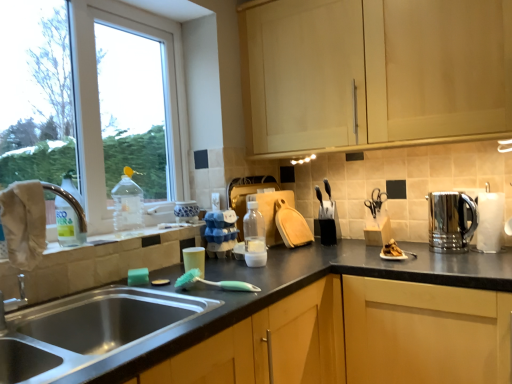
This screenshot has height=384, width=512. What do you see at coordinates (125, 238) in the screenshot?
I see `yellow matte window sill at lower left` at bounding box center [125, 238].

Locate an element on the screen. matte wood cabinet at upper center is located at coordinates (374, 71).

What is the approximate width of matte wood cabinet at upper center?

matte wood cabinet at upper center is 33.91 centimeters wide.

In order to face stainless steel sink at lower left, should I rotate leftwards or rightwards?

To align with it, rotate left about 10.989°.

Image resolution: width=512 pixels, height=384 pixels. What are the coordinates of `transparent plastic bottle at window, marked as the second bottle in a left-to-right arrangement` in the screenshot? It's located at (127, 206).

Consider the image. Does beige fabric at sink left turn towards polished stainless steel kettle at right, which is the first appliance in right-to-left order?

No.

From the image's perspective, which appliance is the 2nd one below the beige fabric at sink left? Please provide its 2D coordinates.

[(450, 221)]

Is polished stainless steel kettle at right, which is the first appliance in right-to-left order, surrounded by beige fabric at sink left?

No, polished stainless steel kettle at right, which is the first appliance in right-to-left order, is not a part of beige fabric at sink left.

Can you tell me how much beige fabric at sink left and polished stainless steel kettle at right, positioned as the third appliance in left-to-right order, differ in facing direction?

beige fabric at sink left and polished stainless steel kettle at right, positioned as the third appliance in left-to-right order, are facing 87.3 degrees away from each other.

From the image's perspective, between matte wood cabinet at upper center and translucent plastic bottle at left, placed as the 3th bottle when sorted from right to left, who is located below?

translucent plastic bottle at left, placed as the 3th bottle when sorted from right to left.

Considering the sizes of objects matte wood cabinet at upper center and translucent plastic bottle at left, placed as the 3th bottle when sorted from right to left, in the image provided, who is wider, matte wood cabinet at upper center or translucent plastic bottle at left, placed as the 3th bottle when sorted from right to left,?

With larger width is matte wood cabinet at upper center.

Is translucent plastic bottle at left, arranged as the first bottle when viewed from the front, at the back of matte wood cabinet at upper center?

No, matte wood cabinet at upper center is not facing the opposite direction of translucent plastic bottle at left, arranged as the first bottle when viewed from the front.

Which object is closer to the camera, translucent plastic cup at sink or polished stainless steel kettle at right, which is the first appliance in right-to-left order?

translucent plastic cup at sink is more forward.

Between translucent plastic cup at sink and polished stainless steel kettle at right, which is the first appliance in right-to-left order, which one has smaller width?

With smaller width is translucent plastic cup at sink.

The image size is (512, 384). I want to click on tableware that appears below the polished stainless steel kettle at right, which is the first appliance in right-to-left order (from the image's perspective), so click(x=194, y=259).

From their relative heights in the image, would you say translucent plastic cup at sink is taller or shorter than polished stainless steel kettle at right, positioned as the third appliance in left-to-right order?

Clearly, translucent plastic cup at sink is shorter compared to polished stainless steel kettle at right, positioned as the third appliance in left-to-right order.

In the scene shown: Considering the sizes of objects translucent plastic cup at sink and stainless steel sink at lower left in the image provided, who is thinner, translucent plastic cup at sink or stainless steel sink at lower left?

With smaller width is translucent plastic cup at sink.

Which object is more forward, translucent plastic cup at sink or stainless steel sink at lower left?

stainless steel sink at lower left is closer to the camera.

You are a GUI agent. You are given a task and a screenshot of the screen. Output one action in this format:
    pyautogui.click(x=<x>, y=<y>)
    Task: Click on the sink in front of the translucent plastic cup at sink
    
    Given the screenshot: What is the action you would take?
    pyautogui.click(x=88, y=330)

Is translucent plastic cup at sink taller than stainless steel sink at lower left?

Incorrect, the height of translucent plastic cup at sink is not larger of that of stainless steel sink at lower left.

Does yellow matte window sill at lower left have a greater height compared to translucent plastic cup at sink?

No, yellow matte window sill at lower left is not taller than translucent plastic cup at sink.

From the image's perspective, does yellow matte window sill at lower left appear lower than translucent plastic cup at sink?

No.

How different are the orientations of yellow matte window sill at lower left and translucent plastic cup at sink in degrees?

0.473 degrees.

Which is behind, point (441, 203) or point (278, 119)?

Point (278, 119)

Would you consider polished stainless steel kettle at right, which is the first appliance in right-to-left order, to be distant from matte wood cabinet at upper center?

They are positioned close to each other.

Between polished stainless steel kettle at right, which is the first appliance in right-to-left order, and matte wood cabinet at upper center, which one has smaller size?

With smaller size is polished stainless steel kettle at right, which is the first appliance in right-to-left order.

I want to click on appliance that appears on the right of matte wood cabinet at upper center, so tap(450, 221).

Is transparent plastic bottle at window, positioned as the second bottle in back-to-front order, closer to the viewer compared to blue and white ceramic jar at upper center, the 1th appliance viewed from the left?

Yes.

Could you tell me if transparent plastic bottle at window, positioned as the second bottle in back-to-front order, is facing blue and white ceramic jar at upper center, the 1th appliance viewed from the left?

No.

Which is behind, point (125, 224) or point (176, 219)?

The point (176, 219) is more distant.

Between transparent plastic bottle at window, positioned as the second bottle in back-to-front order, and blue and white ceramic jar at upper center, the 1th appliance viewed from the left, which one has less height?

With less height is blue and white ceramic jar at upper center, the 1th appliance viewed from the left.

The image size is (512, 384). Identify the location of faucet in front of the polished stainless steel kettle at right, which is the first appliance in right-to-left order. (70, 204).

Image resolution: width=512 pixels, height=384 pixels. Find the location of `the 2nd bottle positioned below the matte wood cabinet at upper center (from the image's perspective)`. the 2nd bottle positioned below the matte wood cabinet at upper center (from the image's perspective) is located at coordinates (69, 215).

Looking at this image, when comparing their distances from translucent plastic bottle at center, placed as the 3th bottle when sorted from front to back, does stainless steel sink at lower left or white paper towel at right seem further?

white paper towel at right is further to translucent plastic bottle at center, placed as the 3th bottle when sorted from front to back.

From the image, which object appears to be farther from white paper towel at right, matte wood cabinet at upper center or blue and white ceramic jar at upper center, arranged as the 3th appliance when viewed from the right?

blue and white ceramic jar at upper center, arranged as the 3th appliance when viewed from the right, lies further to white paper towel at right than the other object.

Considering their positions, is beige fabric at sink left positioned closer to black plastic knife block at upper right, which is the 2th appliance from left to right, than stainless steel sink at lower left?

Based on the image, stainless steel sink at lower left appears to be nearer to black plastic knife block at upper right, which is the 2th appliance from left to right.

Looking at the image, which one is located further to black plastic knife block at upper right, the 2th appliance from the right, white paper towel at right or polished stainless steel kettle at right, which is the first appliance in right-to-left order?

white paper towel at right.

When comparing their distances from blue and white ceramic jar at upper center, arranged as the 3th appliance when viewed from the right, does stainless steel sink at lower left or translucent plastic cup at sink seem closer?

translucent plastic cup at sink.

Estimate the real-world distances between objects in this image. Which object is further from matte wood cabinet at upper center, transparent plastic bottle at window, positioned as the second bottle in back-to-front order, or green rubber brush at sink?

transparent plastic bottle at window, positioned as the second bottle in back-to-front order, is positioned further to the anchor matte wood cabinet at upper center.

Considering their positions, is yellow matte window sill at lower left positioned closer to translucent plastic cup at sink than matte wood cabinet at upper center?

yellow matte window sill at lower left lies closer to translucent plastic cup at sink than the other object.

Estimate the real-world distances between objects in this image. Which object is further from white paper towel at right, stainless steel sink at lower left or translucent plastic bottle at center, the 1th bottle viewed from the right?

Among the two, stainless steel sink at lower left is located further to white paper towel at right.

Where is `tableware situated between translucent plastic bottle at left, arranged as the first bottle when viewed from the front, and matte wood cabinet at upper center from left to right`? tableware situated between translucent plastic bottle at left, arranged as the first bottle when viewed from the front, and matte wood cabinet at upper center from left to right is located at coordinates (194, 259).

The height and width of the screenshot is (384, 512). I want to click on brush between yellow matte window sill at lower left and matte wood cabinet at upper center in the horizontal direction, so click(x=213, y=282).

Identify the location of window sill between translucent plastic bottle at left, arranged as the first bottle when viewed from the front, and polished stainless steel kettle at right, which is the first appliance in right-to-left order. 125,238.

Find the location of a particular element. This screenshot has width=512, height=384. bottle situated between green rubber brush at sink and polished stainless steel kettle at right, which is the first appliance in right-to-left order, from left to right is located at coordinates point(254,229).